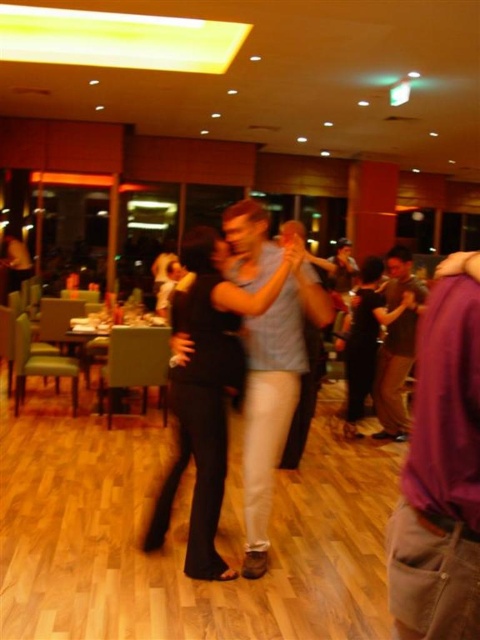
Question: Among these points, which one is farthest from the camera?

Choices:
 (A) (253, 240)
 (B) (387, 392)

Answer: (B)

Question: Does purple cotton shirt at right appear on the left side of light blue cotton shirt at center?

Choices:
 (A) no
 (B) yes

Answer: (A)

Question: Does purple cotton shirt at right lie in front of brown cotton shirt at right?

Choices:
 (A) yes
 (B) no

Answer: (A)

Question: Which is nearer to the brown cotton shirt at right?

Choices:
 (A) purple cotton shirt at right
 (B) light blue cotton shirt at center

Answer: (B)

Question: Where is light blue cotton shirt at center located in relation to brown cotton shirt at right in the image?

Choices:
 (A) above
 (B) below

Answer: (B)

Question: Which point is farther to the camera?

Choices:
 (A) light blue cotton shirt at center
 (B) brown cotton shirt at right
 (C) purple cotton shirt at right

Answer: (B)